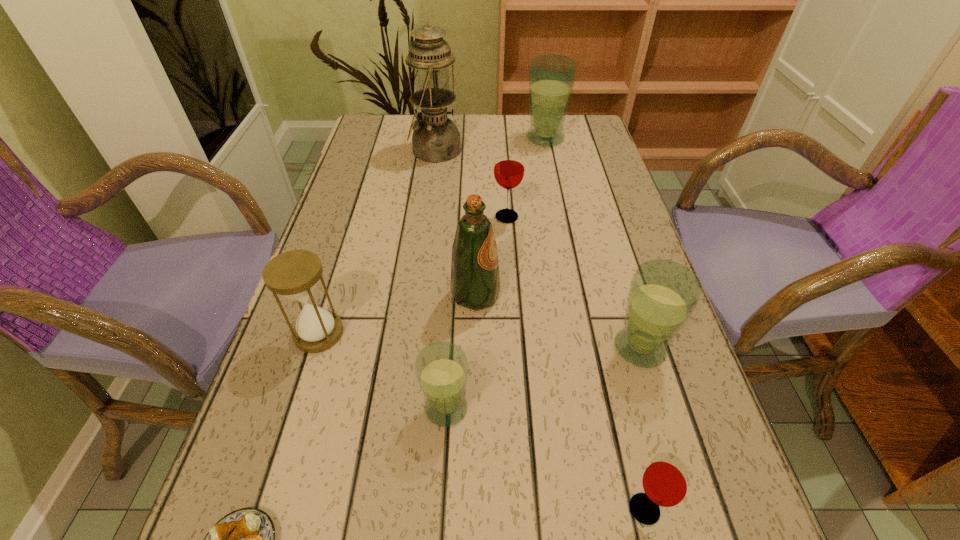
The width and height of the screenshot is (960, 540). In order to click on vacant space at the right edge in this screenshot , I will do `click(594, 277)`.

Find the location of a particular element. The image size is (960, 540). empty space that is in between the green olive oil and the second smallest blue glass is located at coordinates (558, 322).

Where is `vacant region between the nearer red glass and the fourth farthest glass`? The height and width of the screenshot is (540, 960). vacant region between the nearer red glass and the fourth farthest glass is located at coordinates (545, 458).

At what (x,y) coordinates should I click in order to perform the action: click on free point between the oil lamp and the biggest blue glass. Please return your answer as a coordinate pair (x, y). The height and width of the screenshot is (540, 960). Looking at the image, I should click on (490, 144).

Find the location of a particular element. This screenshot has height=540, width=960. free space between the bigger red glass and the right red glass is located at coordinates (575, 363).

You are a GUI agent. You are given a task and a screenshot of the screen. Output one action in this format:
    pyautogui.click(x=<x>, y=<y>)
    Task: Click on the free space between the fourth farthest object and the hourglass
    The width and height of the screenshot is (960, 540).
    Given the screenshot: What is the action you would take?
    pyautogui.click(x=397, y=314)

The image size is (960, 540). What are the coordinates of `free point between the leftmost glass and the oil lamp` in the screenshot? It's located at (441, 279).

Find the location of a particular element. empty space between the fourth farthest object and the second biggest blue glass is located at coordinates (558, 322).

Find the location of a particular element. vacant area that lies between the left red glass and the white hourglass is located at coordinates (413, 275).

Locate an element on the screen. Image resolution: width=960 pixels, height=540 pixels. object that stands as the second closest to the oil lamp is located at coordinates (509, 167).